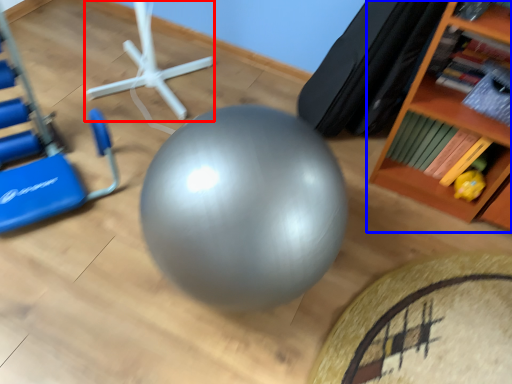
Question: Which point is closer to the camera, sport equipment (highlighted by a red box) or shelf (highlighted by a blue box)?

Choices:
 (A) sport equipment
 (B) shelf

Answer: (B)